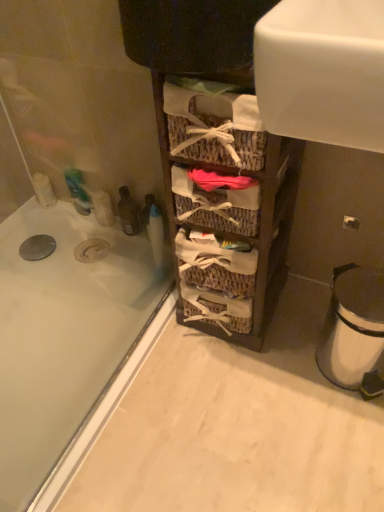
Question: Can you confirm if white metallic trash can at lower right is thinner than woven wood baskets at center?

Choices:
 (A) no
 (B) yes

Answer: (B)

Question: Is woven wood baskets at center surrounded by white metallic trash can at lower right?

Choices:
 (A) yes
 (B) no

Answer: (B)

Question: Are white metallic trash can at lower right and woven wood baskets at center beside each other?

Choices:
 (A) yes
 (B) no

Answer: (B)

Question: Can you confirm if white metallic trash can at lower right is taller than woven wood baskets at center?

Choices:
 (A) no
 (B) yes

Answer: (A)

Question: Is white metallic trash can at lower right aimed at woven wood baskets at center?

Choices:
 (A) yes
 (B) no

Answer: (B)

Question: Looking at the image, does white metallic trash can at lower right seem bigger or smaller compared to white glossy bathtub at lower left?

Choices:
 (A) small
 (B) big

Answer: (A)

Question: From their relative heights in the image, would you say white metallic trash can at lower right is taller or shorter than white glossy bathtub at lower left?

Choices:
 (A) tall
 (B) short

Answer: (A)

Question: Is white metallic trash can at lower right wider or thinner than white glossy bathtub at lower left?

Choices:
 (A) thin
 (B) wide

Answer: (A)

Question: Relative to white glossy bathtub at lower left, is white metallic trash can at lower right in front or behind?

Choices:
 (A) front
 (B) behind

Answer: (B)

Question: Is woven wood baskets at center inside or outside of white glossy bathtub at lower left?

Choices:
 (A) inside
 (B) outside

Answer: (B)

Question: Looking at their shapes, would you say woven wood baskets at center is wider or thinner than white glossy bathtub at lower left?

Choices:
 (A) wide
 (B) thin

Answer: (B)

Question: From a real-world perspective, is woven wood baskets at center positioned above or below white glossy bathtub at lower left?

Choices:
 (A) above
 (B) below

Answer: (A)

Question: Considering the positions of point (226, 106) and point (144, 321), is point (226, 106) closer or farther from the camera than point (144, 321)?

Choices:
 (A) closer
 (B) farther

Answer: (A)

Question: From their relative heights in the image, would you say white glossy bathtub at lower left is taller or shorter than woven wood baskets at center?

Choices:
 (A) tall
 (B) short

Answer: (B)

Question: Do you think white glossy bathtub at lower left is within woven wood baskets at center, or outside of it?

Choices:
 (A) inside
 (B) outside

Answer: (B)